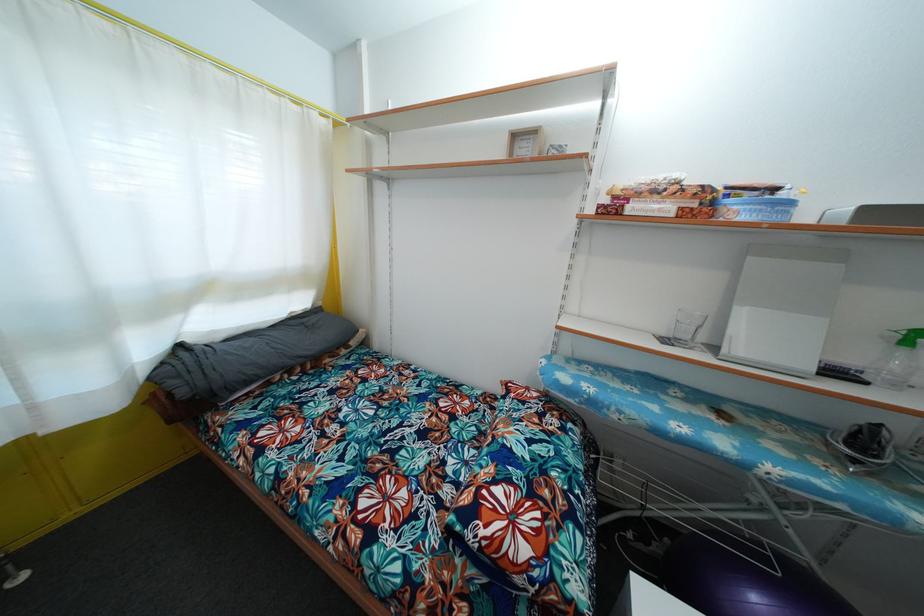
Find where to lift the black remote control. Please return your answer as a coordinate pair (x, y).

(842, 371)